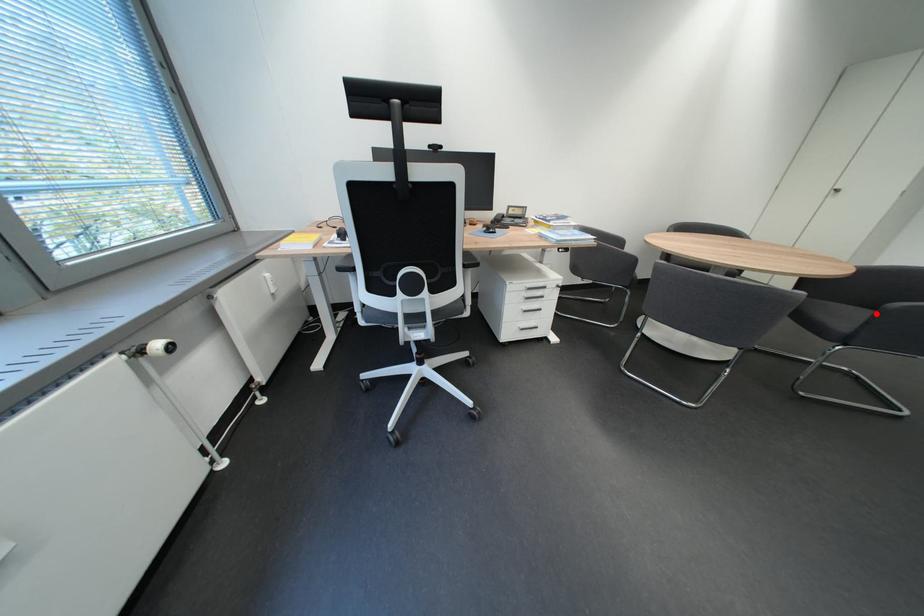
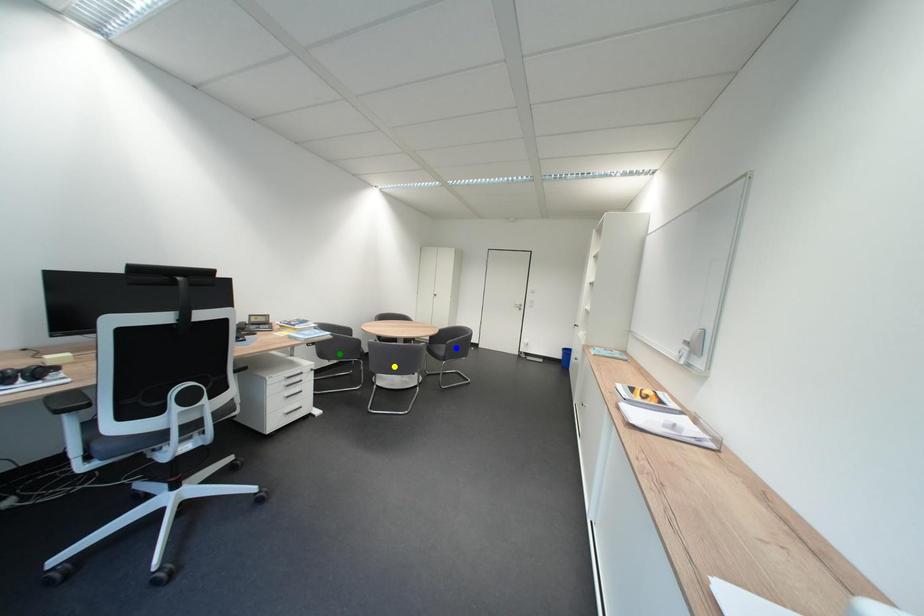
Question: I am providing you with two images of the same scene from different viewpoints. A red point is marked on the first image. You are given multiple points on the second image. Which mark in image 2 goes with the point in image 1?

Choices:
 (A) yellow point
 (B) green point
 (C) blue point

Answer: (C)